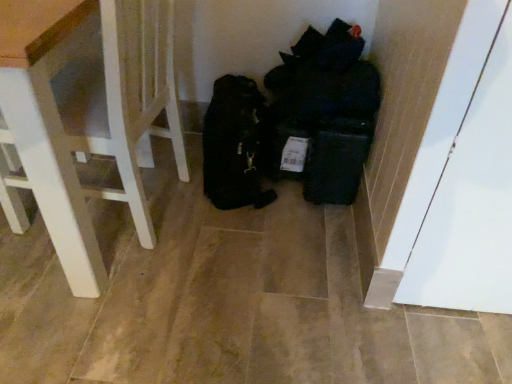
Question: From a real-world perspective, is white wood chair at left physically located above or below black fabric bags at center?

Choices:
 (A) below
 (B) above

Answer: (B)

Question: Is white wood chair at left inside or outside of black fabric bags at center?

Choices:
 (A) outside
 (B) inside

Answer: (A)

Question: In terms of width, does white wood chair at left look wider or thinner when compared to black fabric bags at center?

Choices:
 (A) wide
 (B) thin

Answer: (A)

Question: Considering the positions of point (210, 142) and point (143, 28), is point (210, 142) closer or farther from the camera than point (143, 28)?

Choices:
 (A) closer
 (B) farther

Answer: (B)

Question: Considering the positions of black fabric bags at center and white wood chair at left in the image, is black fabric bags at center taller or shorter than white wood chair at left?

Choices:
 (A) short
 (B) tall

Answer: (A)

Question: Is black fabric bags at center wider or thinner than white wood chair at left?

Choices:
 (A) thin
 (B) wide

Answer: (A)

Question: In the image, is black fabric bags at center positioned in front of or behind white wood chair at left?

Choices:
 (A) front
 (B) behind

Answer: (B)